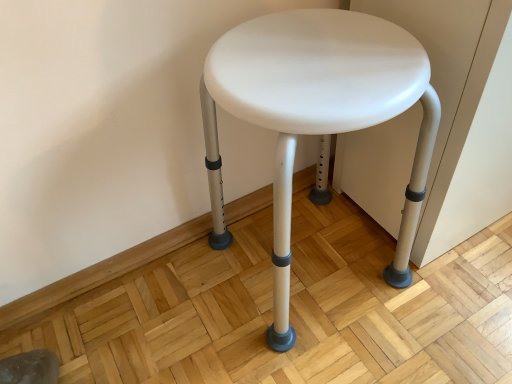
Identify the location of vacant area that lies in front of white plastic stool at center. (333, 355).